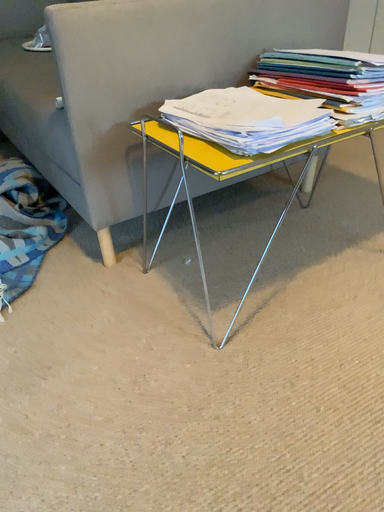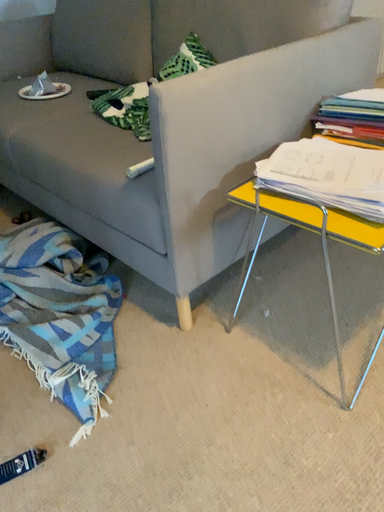
Question: Which way did the camera rotate in the video?

Choices:
 (A) rotated right
 (B) rotated left

Answer: (A)